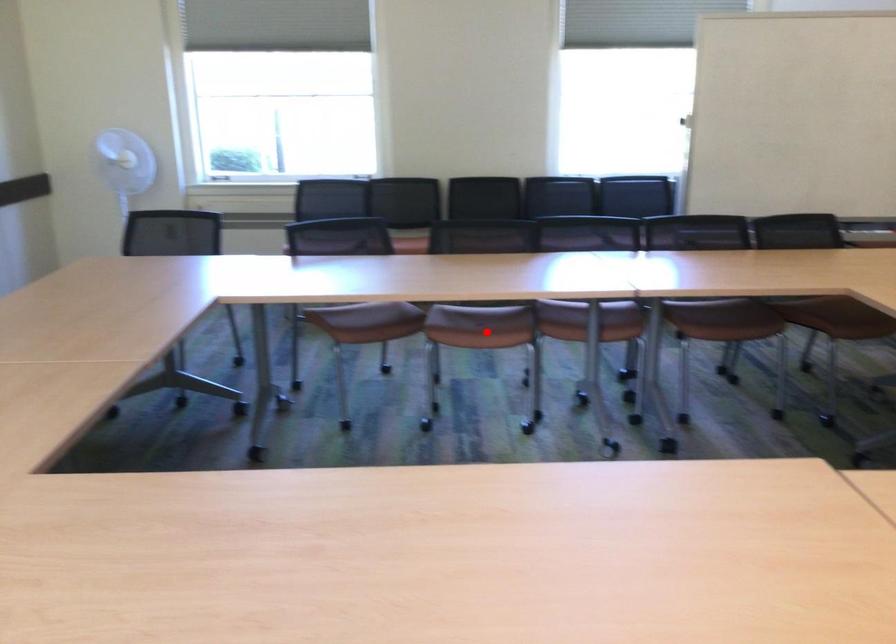
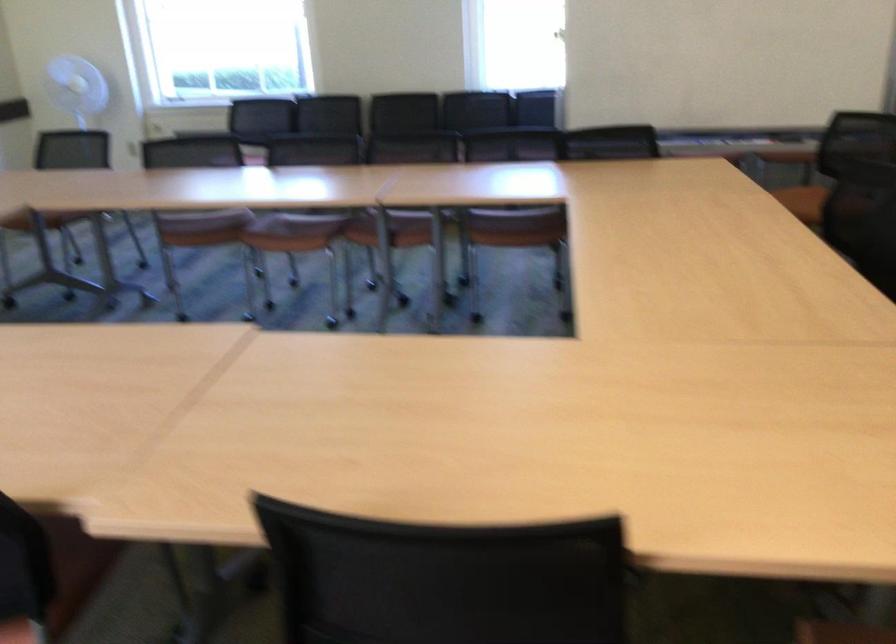
Question: A red point is marked in image1. In image2, is the corresponding 3D point closer to the camera or farther? Reply with the corresponding letter.

Choices:
 (A) The corresponding 3D point is closer.
 (B) The corresponding 3D point is farther.

Answer: (B)